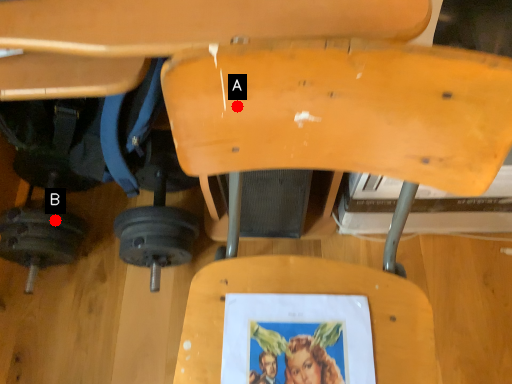
Question: Two points are circled on the image, labeled by A and B beside each circle. Which point is closer to the camera?

Choices:
 (A) A is closer
 (B) B is closer

Answer: (A)